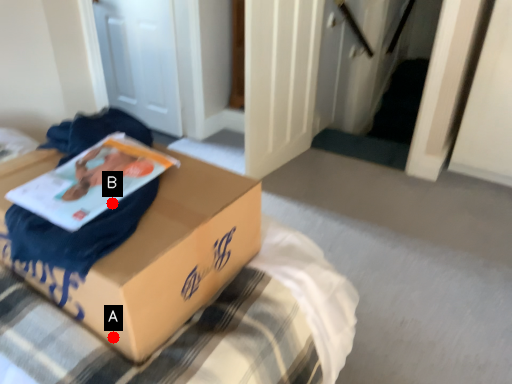
Question: Two points are circled on the image, labeled by A and B beside each circle. Which of the following is the closest to the observer?

Choices:
 (A) A is closer
 (B) B is closer

Answer: (A)